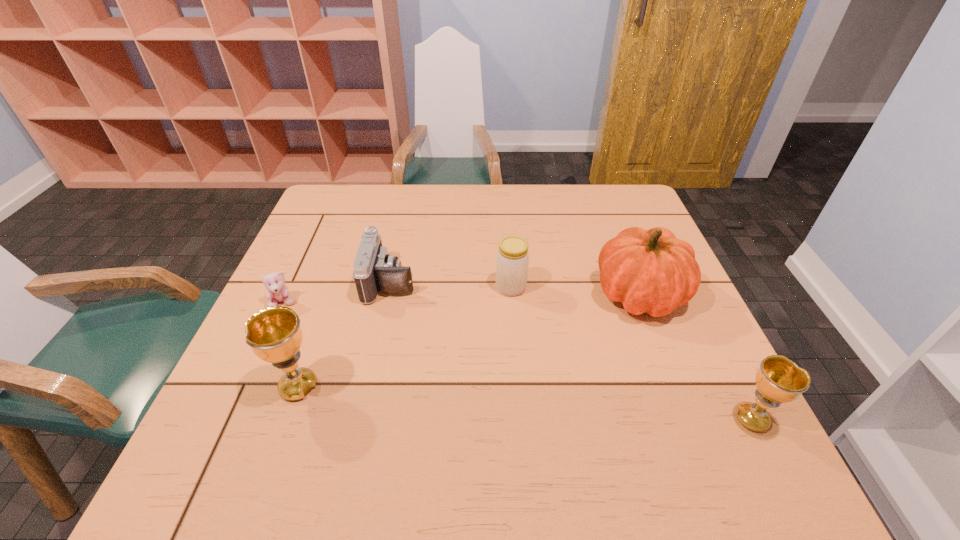
In order to click on empty space between the fifth tallest object and the leftmost object in this screenshot , I will do `click(337, 292)`.

Locate an element on the screen. Image resolution: width=960 pixels, height=540 pixels. free space between the taller chalice and the third object from right to left is located at coordinates (405, 337).

Locate an element on the screen. This screenshot has height=540, width=960. empty space that is in between the fifth object from right to left and the jar is located at coordinates (405, 337).

Find the location of a particular element. The height and width of the screenshot is (540, 960). unoccupied position between the pumpkin and the jar is located at coordinates (575, 291).

I want to click on free space between the second object from left to right and the pumpkin, so click(469, 341).

The width and height of the screenshot is (960, 540). Find the location of `blank region between the left chalice and the jar`. blank region between the left chalice and the jar is located at coordinates (405, 337).

Locate an element on the screen. This screenshot has width=960, height=540. object that is the third closest to the shortest object is located at coordinates (512, 261).

Locate which object is the fourth closest to the second object from left to right. Please provide its 2D coordinates. Your answer should be formatted as a tuple, i.e. [(x, y)], where the tuple contains the x and y coordinates of a point satisfying the conditions above.

[(652, 271)]

Find the location of a particular element. This screenshot has height=540, width=960. vacant space that satisfies the following two spatial constraints: 1. on the back side of the fourth object from left to right; 2. at the front of the second shortest object with an open lens cover is located at coordinates (511, 281).

Locate an element on the screen. free space that satisfies the following two spatial constraints: 1. on the front side of the right chalice; 2. on the left side of the jar is located at coordinates (521, 419).